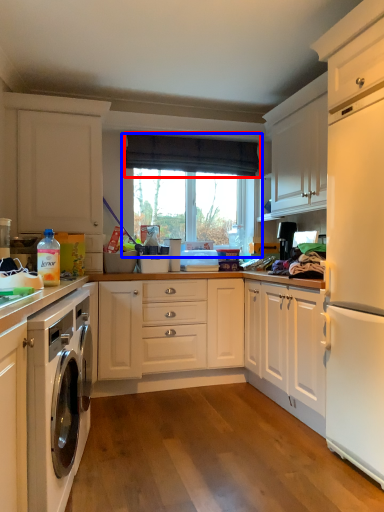
Question: Which object is further to the camera taking this photo, curtain (highlighted by a red box) or window (highlighted by a blue box)?

Choices:
 (A) curtain
 (B) window

Answer: (B)